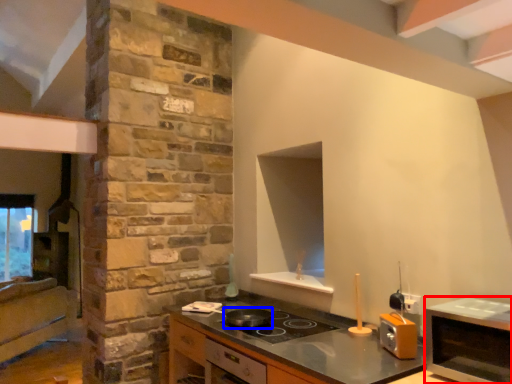
Question: Among these objects, which one is nearest to the camera, microwave (highlighted by a red box) or frying pan (highlighted by a blue box)?

Choices:
 (A) microwave
 (B) frying pan

Answer: (A)